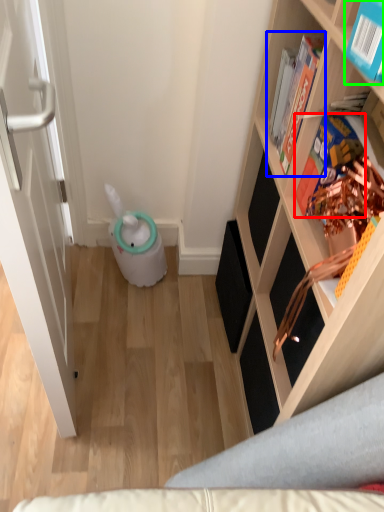
Question: Which is nearer to the book (highlighted by a red box)? book (highlighted by a blue box) or book (highlighted by a green box).

Choices:
 (A) book
 (B) book

Answer: (A)